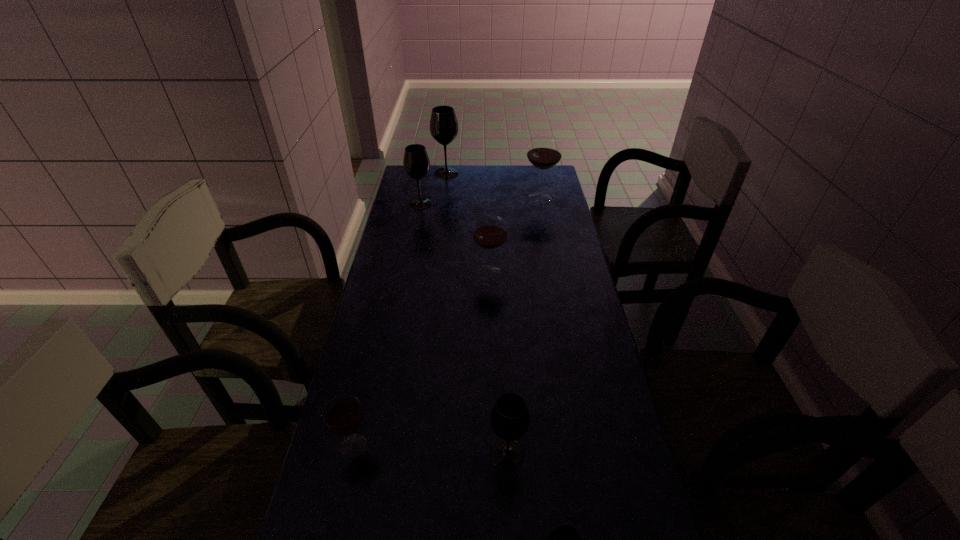
Select which object is the sixth closest to the nearest red wineglass. Please provide its 2D coordinates. Your answer should be formatted as a tuple, i.e. [(x, y)], where the tuple contains the x and y coordinates of a point satisfying the conditions above.

[(443, 124)]

Where is `object that is the fifth nearest to the biggest red wineglass`? object that is the fifth nearest to the biggest red wineglass is located at coordinates (343, 414).

Locate an element on the screen. The image size is (960, 540). wineglass that is the third closest to the third nearest gray wineglass is located at coordinates (544, 152).

Point out which wineglass is positioned as the third nearest to the second smallest red wineglass. Please provide its 2D coordinates. Your answer should be formatted as a tuple, i.e. [(x, y)], where the tuple contains the x and y coordinates of a point satisfying the conditions above.

[(510, 419)]

At what (x,y) coordinates should I click in order to perform the action: click on the second closest gray wineglass to the rightmost object. Please return your answer as a coordinate pair (x, y). Image resolution: width=960 pixels, height=540 pixels. Looking at the image, I should click on (416, 162).

This screenshot has height=540, width=960. In order to click on the fourth closest gray wineglass to the fourth farthest object in this screenshot , I will do pyautogui.click(x=565, y=539).

Identify which red wineglass is the second closest to the smallest red wineglass. Please provide its 2D coordinates. Your answer should be formatted as a tuple, i.e. [(x, y)], where the tuple contains the x and y coordinates of a point satisfying the conditions above.

[(544, 152)]

Find the location of a particular element. red wineglass that is the nearest to the smallest red wineglass is located at coordinates (490, 232).

Identify the location of vacant space that satisfies the following two spatial constraints: 1. on the back side of the tallest object; 2. on the left side of the third nearest gray wineglass. Image resolution: width=960 pixels, height=540 pixels. (426, 173).

The height and width of the screenshot is (540, 960). Find the location of `vacant position in the image that satisfies the following two spatial constraints: 1. on the back side of the third nearest gray wineglass; 2. on the right side of the farthest red wineglass`. vacant position in the image that satisfies the following two spatial constraints: 1. on the back side of the third nearest gray wineglass; 2. on the right side of the farthest red wineglass is located at coordinates (421, 198).